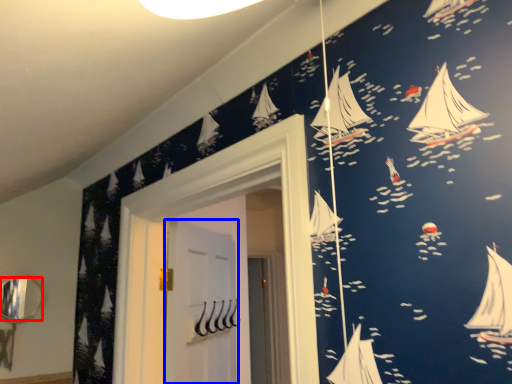
Question: Which object appears closest to the camera in this image, mirror (highlighted by a red box) or door (highlighted by a blue box)?

Choices:
 (A) mirror
 (B) door

Answer: (B)